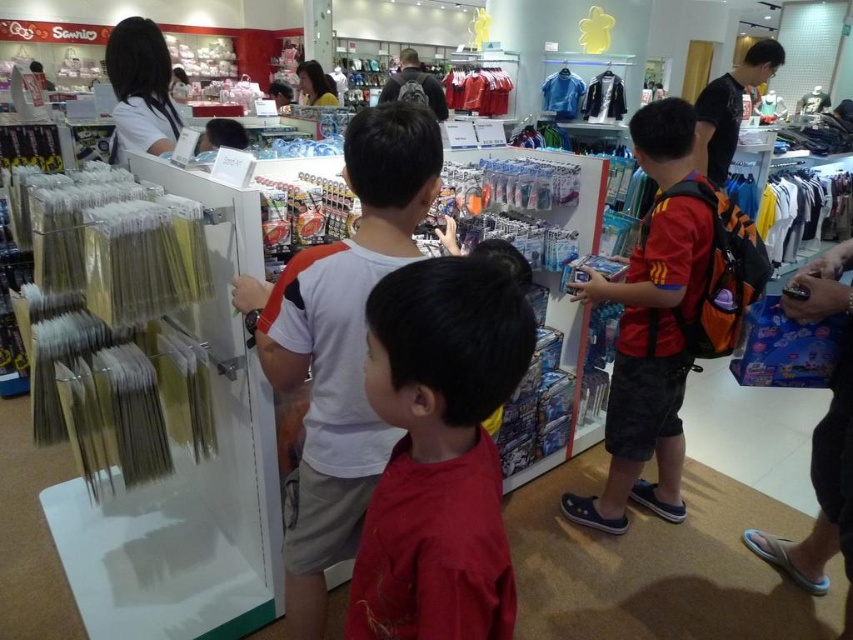
You are a customer in the store and want to find the red polyester shirt at center. According to the store layout, where would you look for it?

The red polyester shirt at center is located at the 2D coordinates point (648,364) in the store layout.

Based on the photo, you are a store employee who needs to restock a shelf that is 1.5 meters wide. You have two shirts to place there, the red cotton shirt at center and the red polyester shirt at center. Can both shirts fit side by side on the shelf?

The distance between the red cotton shirt at center and the red polyester shirt at center is 1.36 meters, so yes, both shirts can fit side by side on the 1.5 meter wide shelf since the combined width is less than the shelf width.

You are a store employee who needs to place a new red polyester shirt at center and a matte black backpack at center on a shelf. The shelf has limited space. Based on the scene, which item should you place first to ensure both fit on the shelf?

The red polyester shirt at center has a smaller size compared to matte black backpack at center, so you should place the matte black backpack at center first to accommodate its larger size, then the red polyester shirt at center can fit around it.